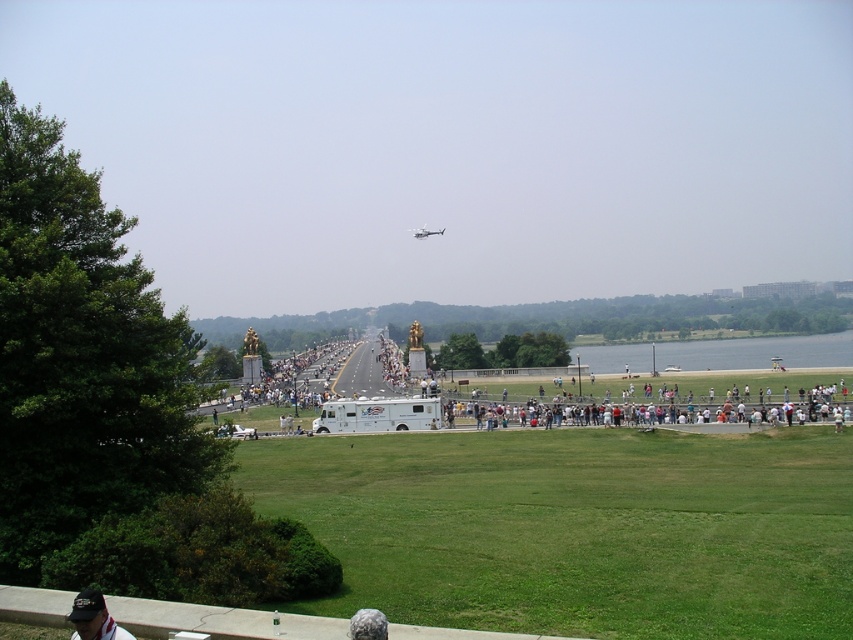
Which is behind, point (115, 627) or point (419, 228)?

Positioned behind is point (419, 228).

Describe the element at coordinates (93, 618) in the screenshot. I see `white fabric cap at lower left` at that location.

Is point (108, 636) positioned in front of point (428, 234)?

That is True.

Identify the location of white fabric cap at lower left. (93, 618).

Locate an element on the screen. The height and width of the screenshot is (640, 853). white van at center is located at coordinates (756, 353).

Which is below, white van at center or white fabric cap at lower left?

white van at center

Does point (648, 349) lie in front of point (84, 618)?

No, it is behind (84, 618).

The image size is (853, 640). Find the location of `white van at center`. white van at center is located at coordinates (756, 353).

Which is in front, point (827, 358) or point (422, 234)?

Point (827, 358) is more forward.

At what (x,y) coordinates should I click in order to perform the action: click on white van at center. Please return your answer as a coordinate pair (x, y). The height and width of the screenshot is (640, 853). Looking at the image, I should click on (756, 353).

You are a GUI agent. You are given a task and a screenshot of the screen. Output one action in this format:
    pyautogui.click(x=<x>, y=<y>)
    Task: Click on the white van at center
    The image size is (853, 640).
    Given the screenshot: What is the action you would take?
    pyautogui.click(x=756, y=353)